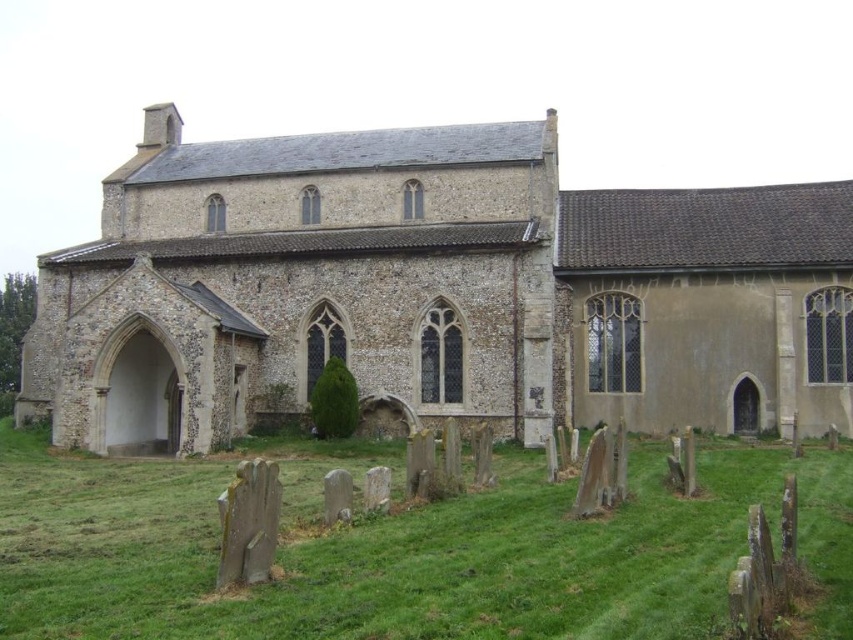
Question: Which point is closer to the camera?

Choices:
 (A) (409, 136)
 (B) (689, 540)

Answer: (B)

Question: Which point is closer to the camera taking this photo?

Choices:
 (A) (190, 264)
 (B) (827, 502)

Answer: (B)

Question: Does stone church at lower left come behind green grass at lower left?

Choices:
 (A) no
 (B) yes

Answer: (B)

Question: From the image, what is the correct spatial relationship of stone church at lower left in relation to green grass at lower left?

Choices:
 (A) left
 (B) right

Answer: (B)

Question: Considering the relative positions of stone church at lower left and green grass at lower left in the image provided, where is stone church at lower left located with respect to green grass at lower left?

Choices:
 (A) right
 (B) left

Answer: (A)